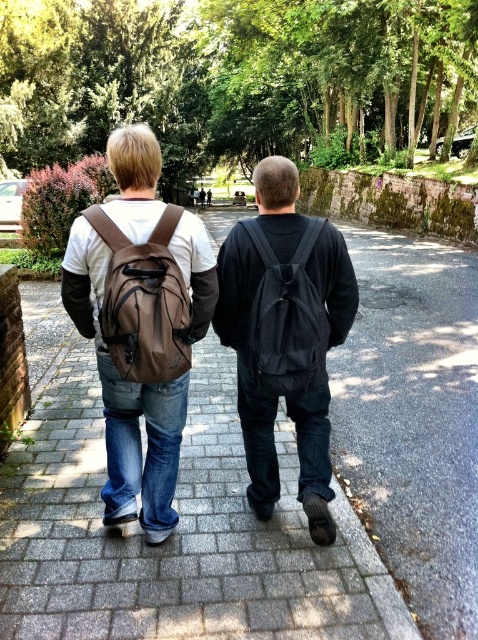
Does point (252, 356) come behind point (276, 380)?

Yes, point (252, 356) is behind point (276, 380).

Between matte black backpack at center and black matte backpack at center, which one appears on the right side from the viewer's perspective?

Positioned to the right is matte black backpack at center.

Does point (336, 330) come in front of point (247, 336)?

No.

What are the coordinates of `matte black backpack at center` in the screenshot? It's located at (284, 336).

Who is shorter, matte brown backpack at left or matte black backpack at center?

matte black backpack at center is shorter.

Is the position of matte brown backpack at left less distant than that of matte black backpack at center?

That is True.

This screenshot has height=640, width=478. In order to click on matte brown backpack at left in this screenshot , I will do `click(141, 324)`.

Between matte brown backpack at left and black matte backpack at center, which one has more height?

matte brown backpack at left is taller.

At what (x,y) coordinates should I click in order to perform the action: click on matte brown backpack at left. Please return your answer as a coordinate pair (x, y). The image size is (478, 640). Looking at the image, I should click on (141, 324).